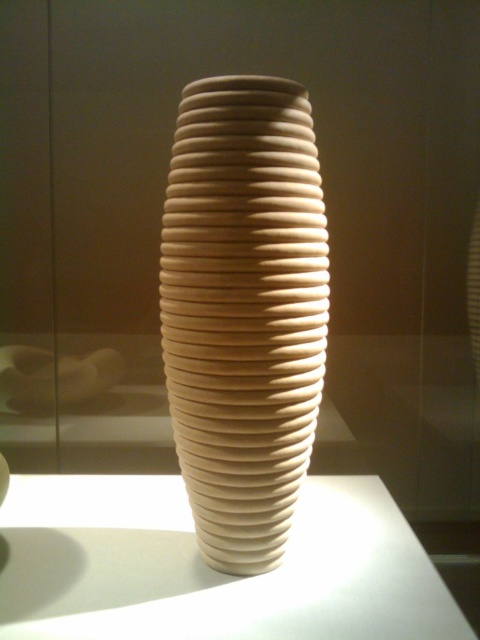
Looking at this image, which of these two, matte beige vase at center or white matte table at center, stands taller?

matte beige vase at center

Can you confirm if matte beige vase at center is shorter than white matte table at center?

In fact, matte beige vase at center may be taller than white matte table at center.

Where is `matte beige vase at center`? The height and width of the screenshot is (640, 480). matte beige vase at center is located at coordinates (243, 310).

This screenshot has height=640, width=480. Identify the location of matte beige vase at center. (243, 310).